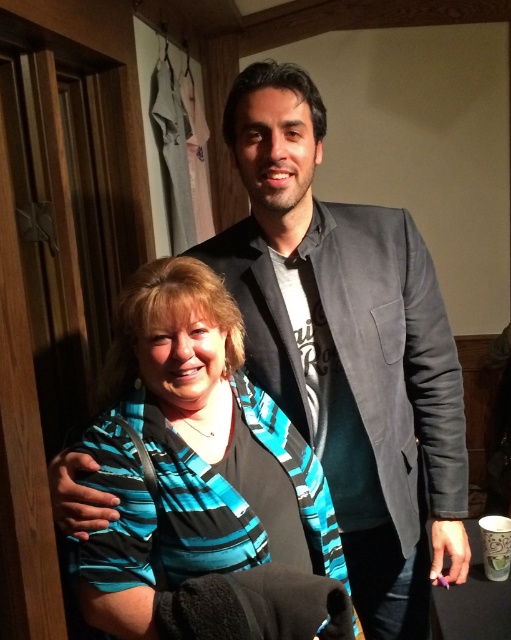
Looking at this image, you are a photographer setting up for a portrait. You notice the gray fabric suit at upper center and the teal striped shirt at center in the frame. Which clothing item is covering part of the other?

The gray fabric suit at upper center is positioned over the teal striped shirt at center, so it is covering part of the teal striped shirt at center.

Based on the scene description, where is the gray fabric suit at upper center located in terms of coordinates?

The gray fabric suit at upper center is located at coordinates point (347, 348).